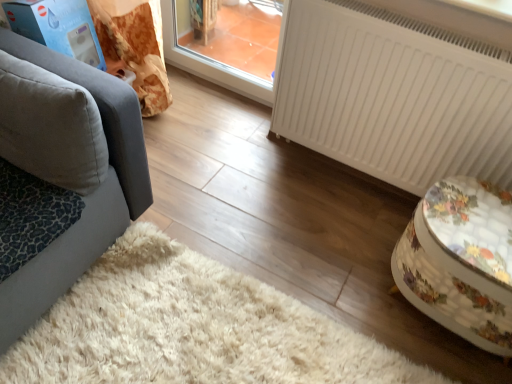
Question: Looking at their shapes, would you say floral fabric ottoman at right is wider or thinner than white matte radiator at right?

Choices:
 (A) thin
 (B) wide

Answer: (B)

Question: Is floral fabric ottoman at right in front of or behind white matte radiator at right in the image?

Choices:
 (A) front
 (B) behind

Answer: (A)

Question: Estimate the real-world distances between objects in this image. Which object is farther from the white matte radiator at right?

Choices:
 (A) floral fabric ottoman at right
 (B) gray fabric pillow at left
 (C) leopard print fabric cat bed at lower left

Answer: (C)

Question: Based on their relative distances, which object is farther from the floral fabric ottoman at right?

Choices:
 (A) white matte radiator at right
 (B) leopard print fabric cat bed at lower left
 (C) gray fabric pillow at left

Answer: (B)